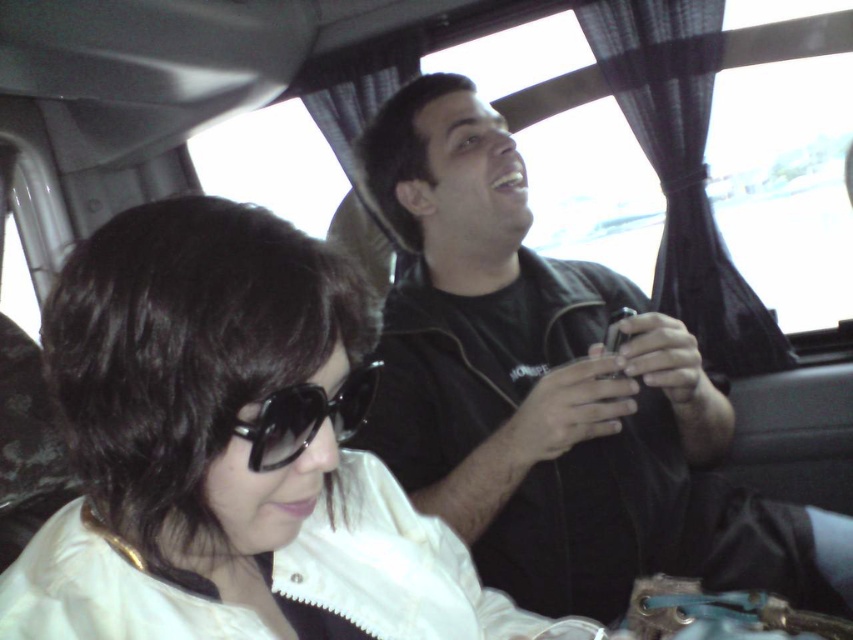
You are designing a storage compartment for the vehicle shown in the image. The compartment must fit both the black matte shirt at center and the black plastic sunglasses at center. Which item requires a wider space in the compartment?

The black matte shirt at center requires a wider space in the compartment because its width is larger than the black plastic sunglasses at center.

You are a passenger in a vehicle and you see a point at coordinate (554, 394). What object is this point located on?

→ The point at coordinate (554, 394) is located on the black matte shirt at center.